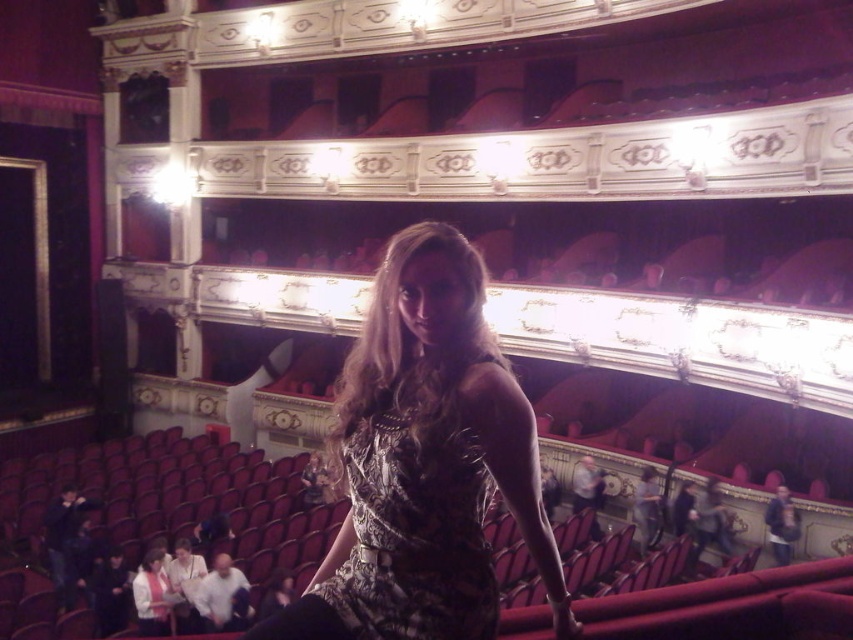
Question: Observing the image, what is the correct spatial positioning of metallic dress at center in reference to printed fabric dress at center?

Choices:
 (A) below
 (B) above

Answer: (A)

Question: Which of the following is the farthest from the observer?

Choices:
 (A) metallic dress at center
 (B) printed fabric dress at center

Answer: (B)

Question: Which object is closer to the camera taking this photo?

Choices:
 (A) printed fabric dress at center
 (B) metallic dress at center

Answer: (B)

Question: Can you confirm if metallic dress at center is smaller than printed fabric dress at center?

Choices:
 (A) yes
 (B) no

Answer: (B)

Question: Can you confirm if metallic dress at center is wider than printed fabric dress at center?

Choices:
 (A) yes
 (B) no

Answer: (A)

Question: Which of the following is the closest to the observer?

Choices:
 (A) metallic dress at center
 (B) printed fabric dress at center

Answer: (A)